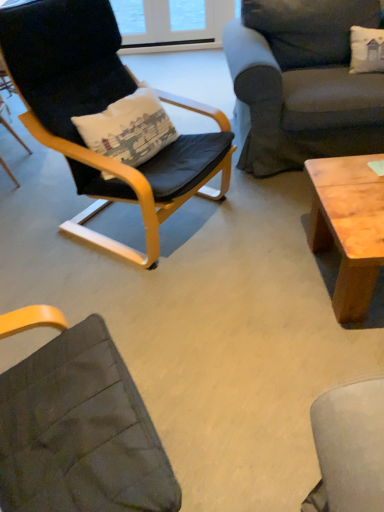
Question: Is black leather chair at left, the first chair when ordered from right to left, far from matte black chair at left, which ranks as the first chair in left-to-right order?

Choices:
 (A) yes
 (B) no

Answer: (B)

Question: Considering the relative sizes of black leather chair at left, which is the second chair from left to right, and matte black chair at left, which ranks as the first chair in left-to-right order, in the image provided, is black leather chair at left, which is the second chair from left to right, shorter than matte black chair at left, which ranks as the first chair in left-to-right order,?

Choices:
 (A) no
 (B) yes

Answer: (A)

Question: Is black leather chair at left, which is the second chair from left to right, surrounding matte black chair at left, placed as the second chair when sorted from right to left?

Choices:
 (A) no
 (B) yes

Answer: (A)

Question: Is black leather chair at left, the first chair when ordered from right to left, outside of matte black chair at left, which ranks as the first chair in left-to-right order?

Choices:
 (A) no
 (B) yes

Answer: (B)

Question: Considering the relative sizes of black leather chair at left, which is the second chair from left to right, and matte black chair at left, placed as the second chair when sorted from right to left, in the image provided, is black leather chair at left, which is the second chair from left to right, wider than matte black chair at left, placed as the second chair when sorted from right to left,?

Choices:
 (A) no
 (B) yes

Answer: (B)

Question: From a real-world perspective, is black leather chair at left, the first chair when ordered from right to left, located higher than matte black chair at left, placed as the second chair when sorted from right to left?

Choices:
 (A) no
 (B) yes

Answer: (B)

Question: From a real-world perspective, does dark gray fabric couch at upper right stand above natural wood coffee table at right?

Choices:
 (A) yes
 (B) no

Answer: (A)

Question: Can you confirm if dark gray fabric couch at upper right is wider than natural wood coffee table at right?

Choices:
 (A) no
 (B) yes

Answer: (B)

Question: Does dark gray fabric couch at upper right appear on the right side of natural wood coffee table at right?

Choices:
 (A) no
 (B) yes

Answer: (B)

Question: Can natural wood coffee table at right be found inside dark gray fabric couch at upper right?

Choices:
 (A) no
 (B) yes

Answer: (A)

Question: Does dark gray fabric couch at upper right touch natural wood coffee table at right?

Choices:
 (A) yes
 (B) no

Answer: (B)

Question: Does dark gray fabric couch at upper right have a greater height compared to natural wood coffee table at right?

Choices:
 (A) no
 (B) yes

Answer: (B)

Question: Is dark gray fabric couch at upper right surrounding matte black chair at left, placed as the second chair when sorted from right to left?

Choices:
 (A) no
 (B) yes

Answer: (A)